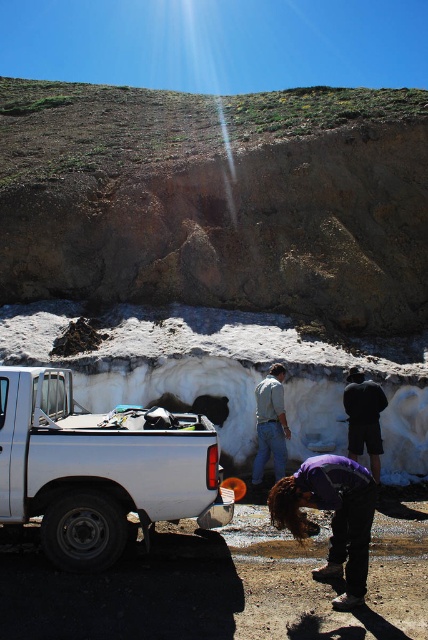
You are standing at the point marked by the coordinates point (332, 516) in the image. Looking around, you see the white pickup truck parked on a gravel surface and the large snow covered structure resembling a small cave or igloo like formation in the midground. Which object is closer to you, the white pickup truck or the large snow covered structure resembling a small cave or igloo like formation?

The purple fabric at lower center corresponds to point (332, 516). Since the purple fabric at lower center is located at lower center, the white pickup truck parked on a gravel surface is closer to you than the large snow covered structure resembling a small cave or igloo like formation in the midground.

You are a hiker who needs to place a 15 meter long tent between the brown rough rock at upper center and the purple fabric at lower center. Can the tent fit between them without overlapping either object?

The distance between the brown rough rock at upper center and the purple fabric at lower center is 17.00 meters. Since the tent is 15 meters long, it can fit between them without overlapping either object as there is an extra 2 meters of space.

You are organizing items in the truck bed and need to place both the purple fabric at lower center and the light gray cotton shirt at center. Since space is limited, which item should you prioritize placing first to accommodate both?

The purple fabric at lower center should be placed first because its width is larger than the light gray cotton shirt at center, allowing you to position it in a way that both items fit within the limited space.